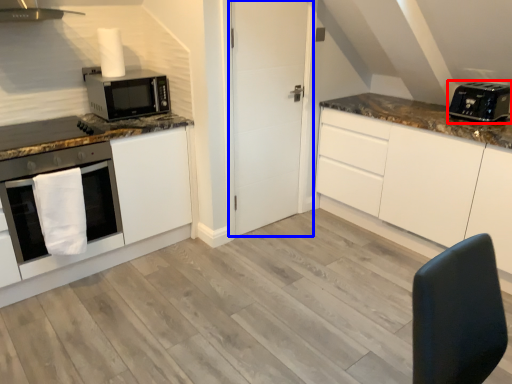
Question: Which point is further to the camera, toaster (highlighted by a red box) or door (highlighted by a blue box)?

Choices:
 (A) toaster
 (B) door

Answer: (B)